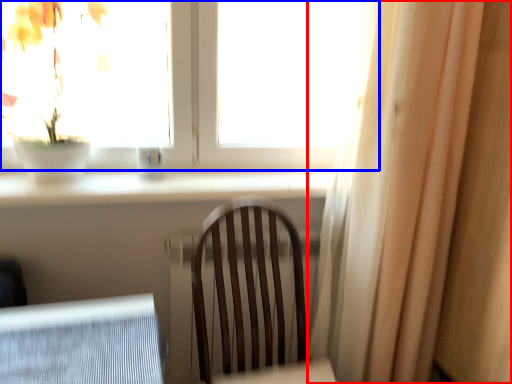
Question: Which of the following is the closest to the observer, curtain (highlighted by a red box) or window (highlighted by a blue box)?

Choices:
 (A) curtain
 (B) window

Answer: (A)